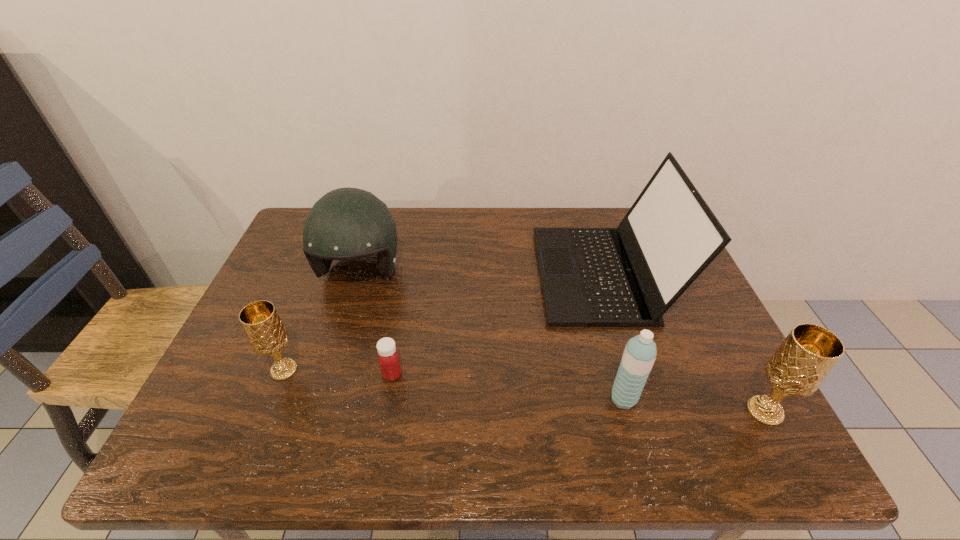
The image size is (960, 540). What are the coordinates of `free region located on the surface of the laptop` in the screenshot? It's located at tap(414, 274).

At what (x,y) coordinates should I click in order to perform the action: click on free space located 0.230m on the surface of the laptop. Please return your answer as a coordinate pair (x, y). This screenshot has width=960, height=540. Looking at the image, I should click on (457, 274).

Image resolution: width=960 pixels, height=540 pixels. Find the location of `vacant space positioned 0.250m on the surface of the laptop`. vacant space positioned 0.250m on the surface of the laptop is located at coordinates (449, 274).

Where is `vacant space located at the face opening of the football helmet`? vacant space located at the face opening of the football helmet is located at coordinates (346, 321).

At what (x,y) coordinates should I click in order to perform the action: click on vacant space located on the right of the shortest object. Please return your answer as a coordinate pair (x, y). This screenshot has height=540, width=960. Looking at the image, I should click on (554, 374).

Where is `free space located on the left of the water bottle`? The width and height of the screenshot is (960, 540). free space located on the left of the water bottle is located at coordinates (525, 399).

Find the location of `laptop that is at the far edge`. laptop that is at the far edge is located at coordinates point(629,276).

I want to click on football helmet that is positioned at the far edge, so coord(346,223).

Where is `medicine at the near edge`? This screenshot has width=960, height=540. medicine at the near edge is located at coordinates (388, 357).

Locate an element on the screen. water bottle present at the near edge is located at coordinates (639, 355).